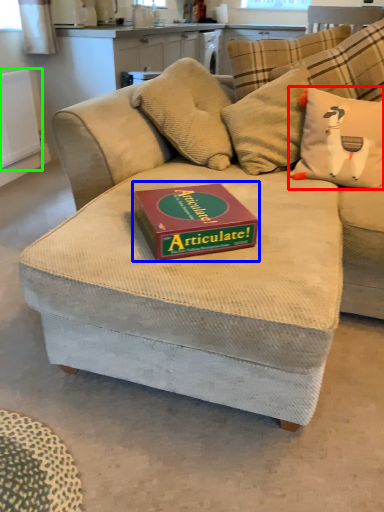
Question: Which object is the farthest from throw pillow (highlighted by a red box)? Choose among these: paperback book (highlighted by a blue box) or radiator (highlighted by a green box).

Choices:
 (A) paperback book
 (B) radiator

Answer: (B)